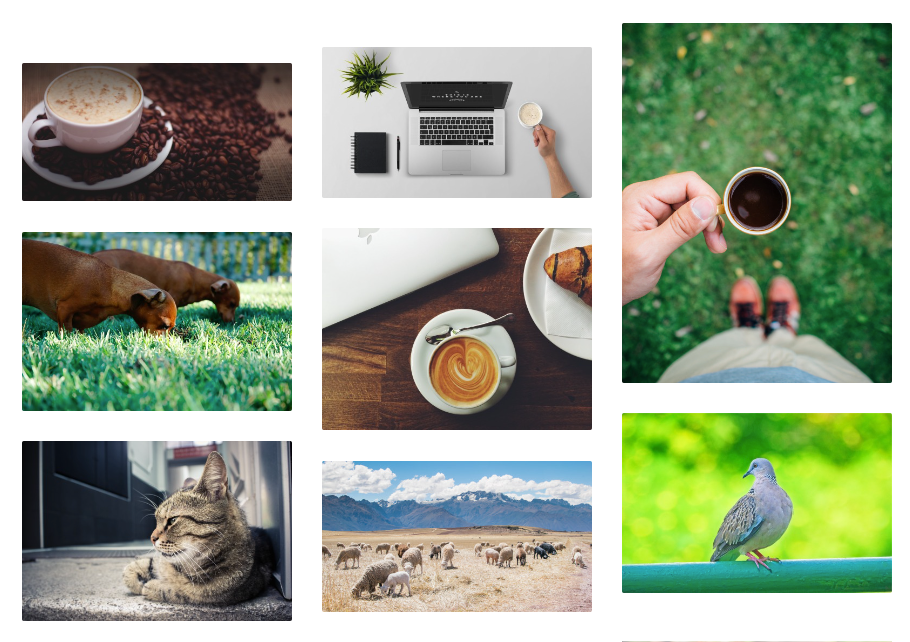
This screenshot has width=910, height=642. Identify the location of rug. (94, 594).